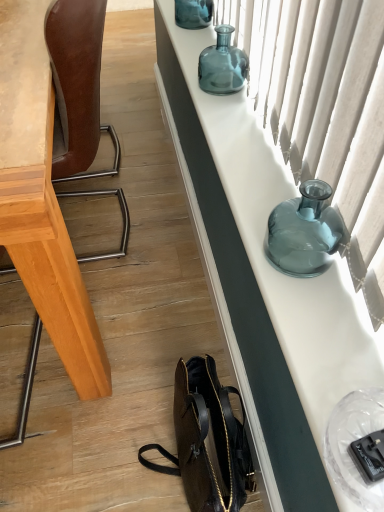
Locate an element on the screen. Image resolution: width=384 pixels, height=512 pixels. vacant space in front of brown leather chair at left is located at coordinates click(x=122, y=316).